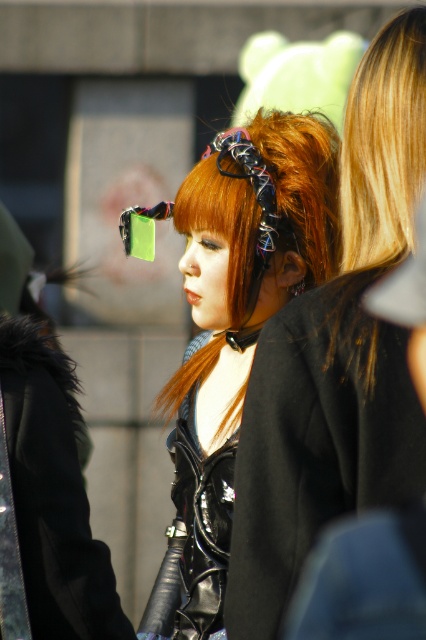
Question: Estimate the real-world distances between objects in this image. Which object is farther from the blonde smooth hair at right?

Choices:
 (A) shiny black leather jacket at center
 (B) multicolored fabric headscarf at center
 (C) leather dress at center
 (D) black leather coat at center

Answer: (C)

Question: Among these points, which one is nearest to the camera?

Choices:
 (A) (348, 112)
 (B) (40, 529)
 (C) (183, 406)
 (D) (385, 189)

Answer: (D)

Question: Does blonde smooth hair at right have a greater width compared to leather dress at center?

Choices:
 (A) no
 (B) yes

Answer: (A)

Question: Is blonde smooth hair at right to the left of leather dress at center from the viewer's perspective?

Choices:
 (A) yes
 (B) no

Answer: (B)

Question: Estimate the real-world distances between objects in this image. Which object is farther from the shiny black leather jacket at center?

Choices:
 (A) multicolored fabric headscarf at center
 (B) blonde smooth hair at right
 (C) black leather coat at center

Answer: (B)

Question: Can you confirm if shiny black hair at center is positioned above leather dress at center?

Choices:
 (A) yes
 (B) no

Answer: (A)